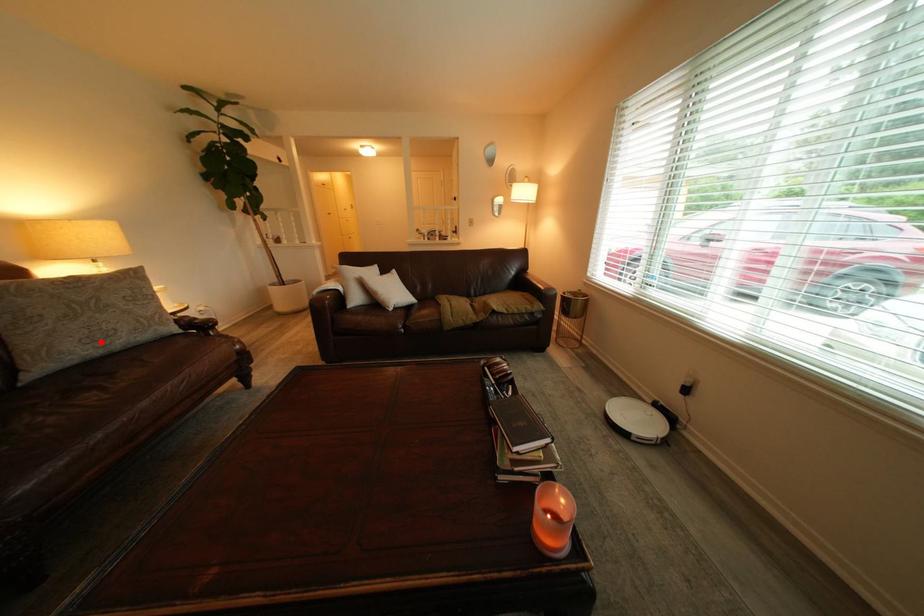
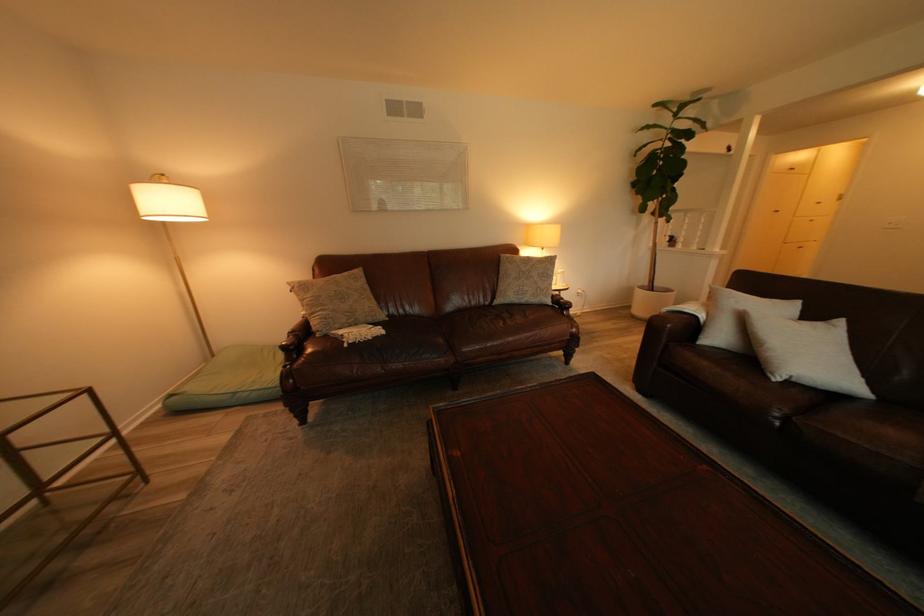
Locate, in the second image, the point that corresponds to the highlighted location in the first image.

(529, 294)